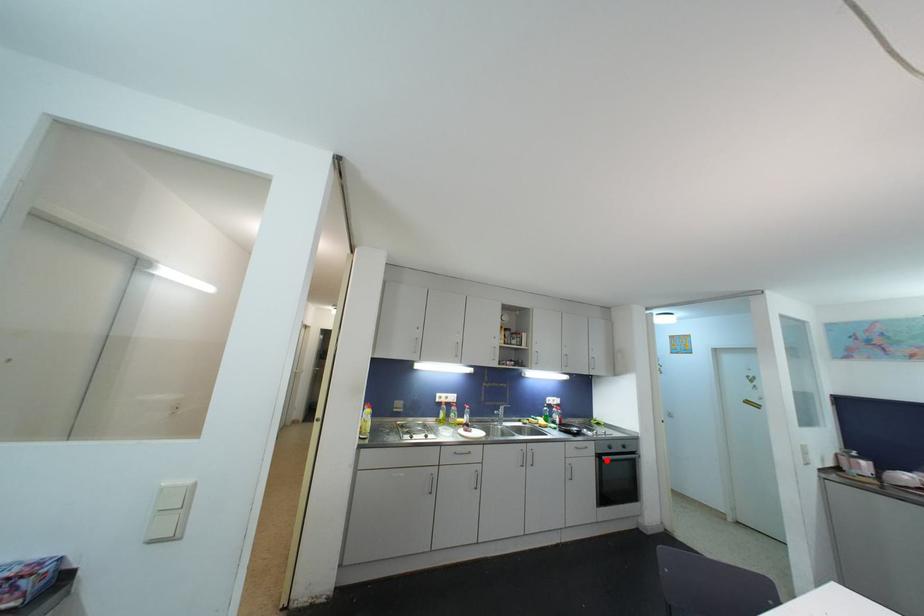
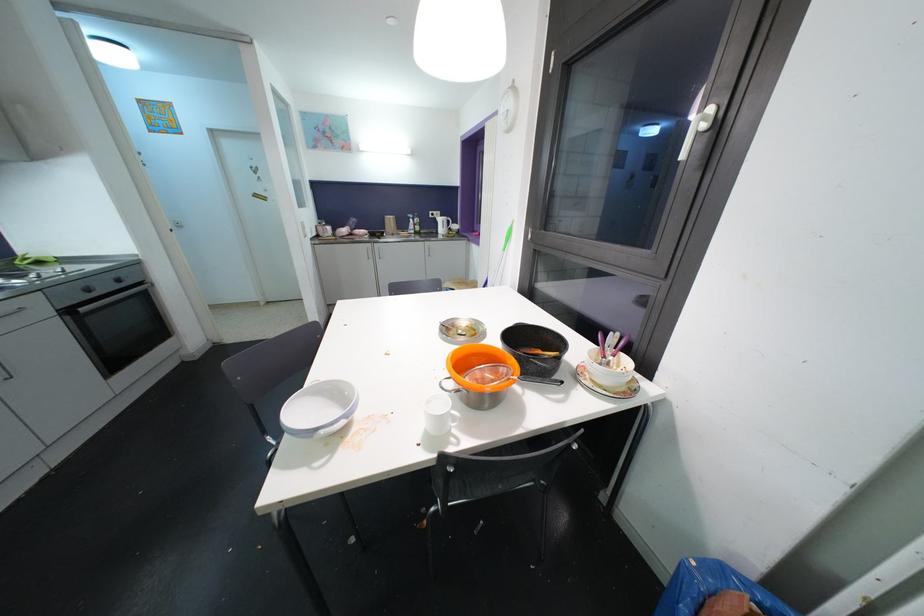
In the second image, find the point that corresponds to the highlighted location in the first image.

(84, 312)